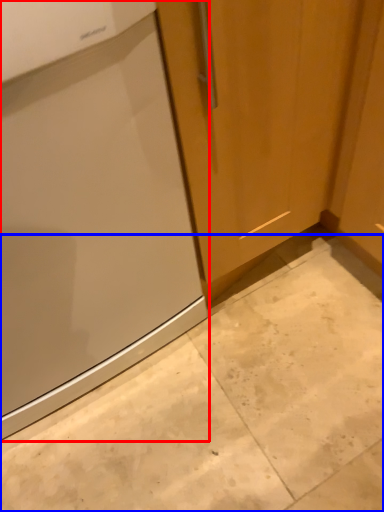
Question: Which object appears farthest to the camera in this image, home appliance (highlighted by a red box) or concrete (highlighted by a blue box)?

Choices:
 (A) home appliance
 (B) concrete

Answer: (A)